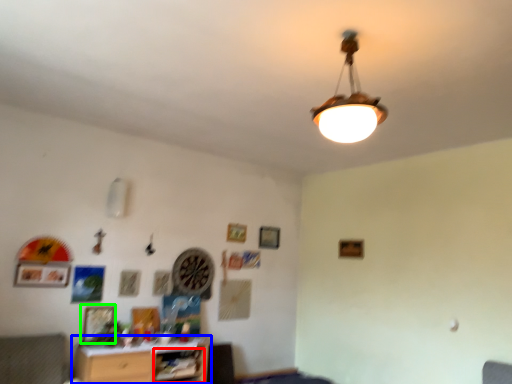
Question: Based on their relative distances, which object is farther from shelf (highlighted by a red box)? Choose from table (highlighted by a blue box) and picture frame (highlighted by a green box).

Choices:
 (A) table
 (B) picture frame

Answer: (B)